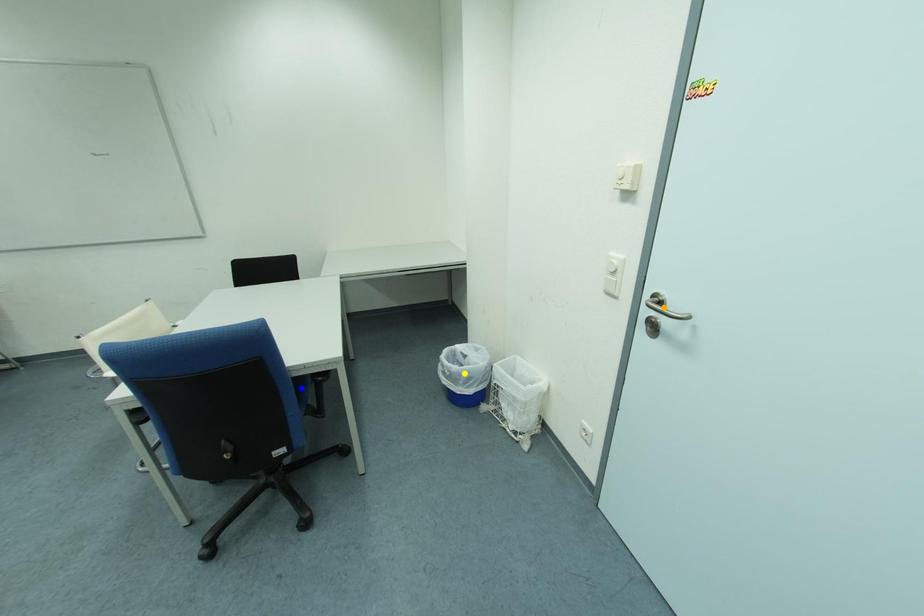
Order these from nearest to farthest:
A) yellow point
B) blue point
C) orange point

orange point → blue point → yellow point